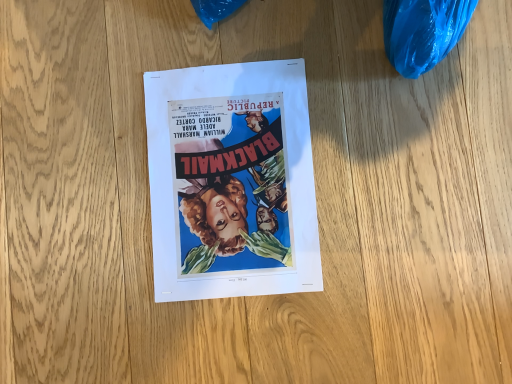
What is the approximate width of matte paper poster at center?

It is 12.16 inches.

Locate an element on the screen. matte paper poster at center is located at coordinates (231, 181).

Describe the element at coordinates (231, 181) in the screenshot. I see `matte paper poster at center` at that location.

Where is `matte paper poster at center`? matte paper poster at center is located at coordinates (231, 181).